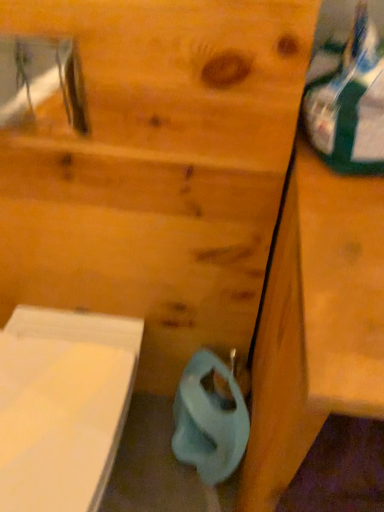
Question: Relative to wooden vanity at right, is blue matte toilet paper at lower center in front or behind?

Choices:
 (A) front
 (B) behind

Answer: (B)

Question: Is blue matte toilet paper at lower center taller or shorter than wooden vanity at right?

Choices:
 (A) tall
 (B) short

Answer: (B)

Question: Considering the positions of blue matte toilet paper at lower center and wooden vanity at right in the image, is blue matte toilet paper at lower center wider or thinner than wooden vanity at right?

Choices:
 (A) thin
 (B) wide

Answer: (A)

Question: From the image's perspective, relative to blue matte toilet paper at lower center, is wooden vanity at right above or below?

Choices:
 (A) below
 (B) above

Answer: (B)

Question: Considering the positions of point [x=374, y=265] and point [x=200, y=384], is point [x=374, y=265] closer or farther from the camera than point [x=200, y=384]?

Choices:
 (A) closer
 (B) farther

Answer: (A)

Question: Relative to blue matte toilet paper at lower center, is wooden vanity at right in front or behind?

Choices:
 (A) behind
 (B) front

Answer: (B)

Question: Looking at their shapes, would you say wooden vanity at right is wider or thinner than blue matte toilet paper at lower center?

Choices:
 (A) wide
 (B) thin

Answer: (A)